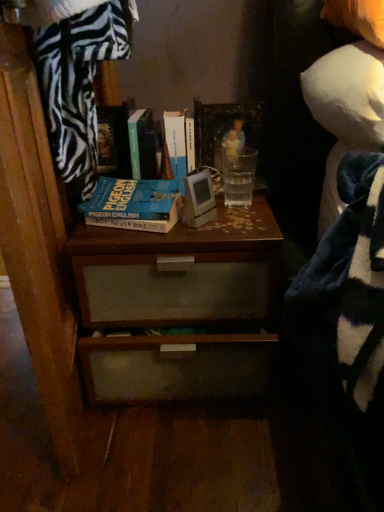
The height and width of the screenshot is (512, 384). I want to click on brown wood chest of drawers at center, so click(179, 307).

Measure the distance between green matte book at upper center, arranged as the 2th book when viewed from the left, and camera.

green matte book at upper center, arranged as the 2th book when viewed from the left, and camera are 3.32 feet apart from each other.

What is the approximate height of blue matte book at center, placed as the third book when sorted from right to left?

It is 3.36 inches.

Describe the element at coordinates (134, 204) in the screenshot. Image resolution: width=384 pixels, height=512 pixels. I see `blue matte book at center, placed as the third book when sorted from right to left` at that location.

What do you see at coordinates (78, 84) in the screenshot? Image resolution: width=384 pixels, height=512 pixels. I see `zebra-patterned fabric at upper left` at bounding box center [78, 84].

Where is `zebra-patterned fabric at upper left`? zebra-patterned fabric at upper left is located at coordinates (78, 84).

Measure the distance between point (180, 151) and camera.

Point (180, 151) is 3.50 feet away from camera.

Find the location of a particular element. Image resolution: width=384 pixels, height=512 pixels. brown wood chest of drawers at center is located at coordinates (179, 307).

What are the coordinates of `chest of drawers below the green matte book at upper center, which is counted as the second book, starting from the right (from a real-world perspective)` in the screenshot? It's located at (179, 307).

Based on the photo, is brown wood chest of drawers at center to the left or to the right of green matte book at upper center, arranged as the 2th book when viewed from the left, in the image?

brown wood chest of drawers at center is positioned on green matte book at upper center, arranged as the 2th book when viewed from the left,'s right side.

Who is taller, brown wood chest of drawers at center or green matte book at upper center, arranged as the 2th book when viewed from the left?

brown wood chest of drawers at center is taller.

Considering the sizes of objects brown wood chest of drawers at center and green matte book at upper center, arranged as the 2th book when viewed from the left, in the image provided, who is wider, brown wood chest of drawers at center or green matte book at upper center, arranged as the 2th book when viewed from the left,?

Wider between the two is brown wood chest of drawers at center.

In the scene shown: Can you tell me how much hardcover book at center, marked as the 3th book in a left-to-right arrangement, and brown wood chest of drawers at center differ in facing direction?

0.000389 degrees separate the facing orientations of hardcover book at center, marked as the 3th book in a left-to-right arrangement, and brown wood chest of drawers at center.

Which object is more forward, hardcover book at center, marked as the 3th book in a left-to-right arrangement, or brown wood chest of drawers at center?

brown wood chest of drawers at center.

Can you confirm if hardcover book at center, the 1th book positioned from the right, is smaller than brown wood chest of drawers at center?

Yes, hardcover book at center, the 1th book positioned from the right, is smaller than brown wood chest of drawers at center.

Which of these two, wooden picture frame at center or brown wood chest of drawers at center, stands taller?

brown wood chest of drawers at center is taller.

Does wooden picture frame at center appear on the right side of brown wood chest of drawers at center?

Yes, wooden picture frame at center is to the right of brown wood chest of drawers at center.

Identify the location of chest of drawers on the left of wooden picture frame at center. This screenshot has width=384, height=512. (179, 307).

From the image's perspective, which is above, wooden picture frame at center or brown wood chest of drawers at center?

wooden picture frame at center is shown above in the image.

Can you confirm if zebra-patterned fabric at upper left is bigger than green matte book at upper center, which is counted as the second book, starting from the right?

Indeed, zebra-patterned fabric at upper left has a larger size compared to green matte book at upper center, which is counted as the second book, starting from the right.

Which object is more forward, zebra-patterned fabric at upper left or green matte book at upper center, arranged as the 2th book when viewed from the left?

zebra-patterned fabric at upper left.

Would you say zebra-patterned fabric at upper left is outside green matte book at upper center, arranged as the 2th book when viewed from the left?

Absolutely, zebra-patterned fabric at upper left is external to green matte book at upper center, arranged as the 2th book when viewed from the left.

Is point (140, 210) behind point (264, 298)?

No, (140, 210) is closer to viewer.

Who is shorter, blue matte book at center, placed as the third book when sorted from right to left, or brown wood chest of drawers at center?

With less height is blue matte book at center, placed as the third book when sorted from right to left.

Which is more to the left, blue matte book at center, placed as the third book when sorted from right to left, or brown wood chest of drawers at center?

Positioned to the left is blue matte book at center, placed as the third book when sorted from right to left.

Are blue matte book at center, placed as the third book when sorted from right to left, and brown wood chest of drawers at center far apart?

They are positioned close to each other.

Is hardcover book at center, marked as the 3th book in a left-to-right arrangement, facing towards white fabric doll at upper right?

No, hardcover book at center, marked as the 3th book in a left-to-right arrangement, is not aimed at white fabric doll at upper right.

Which is in front, hardcover book at center, marked as the 3th book in a left-to-right arrangement, or white fabric doll at upper right?

white fabric doll at upper right is in front.

How many degrees apart are the facing directions of hardcover book at center, marked as the 3th book in a left-to-right arrangement, and white fabric doll at upper right?

They differ by 0.468 degrees in their facing directions.

From the image's perspective, is hardcover book at center, the 1th book positioned from the right, on top of white fabric doll at upper right?

No, from the image's perspective, hardcover book at center, the 1th book positioned from the right, is not on top of white fabric doll at upper right.

Is wooden picture frame at center wider or thinner than green matte book at upper center, arranged as the 2th book when viewed from the left?

wooden picture frame at center is thinner than green matte book at upper center, arranged as the 2th book when viewed from the left.

Based on the photo, is wooden picture frame at center with green matte book at upper center, arranged as the 2th book when viewed from the left?

There is a gap between wooden picture frame at center and green matte book at upper center, arranged as the 2th book when viewed from the left.

Can you tell me how much wooden picture frame at center and green matte book at upper center, arranged as the 2th book when viewed from the left, differ in facing direction?

They differ by 0.000689 degrees in their facing directions.

The image size is (384, 512). I want to click on the 2nd book directly above the wooden picture frame at center (from a real-world perspective), so click(142, 144).

Where is `book that is the 3rd one above the brown wood chest of drawers at center (from a real-world perspective)`? book that is the 3rd one above the brown wood chest of drawers at center (from a real-world perspective) is located at coordinates (x=142, y=144).

From the image's perspective, which book is the 3rd one above the brown wood chest of drawers at center? Please provide its 2D coordinates.

[(175, 145)]

Estimate the real-world distances between objects in this image. Which object is closer to white fabric doll at upper right, green matte book at upper center, arranged as the 2th book when viewed from the left, or hardcover book at center, the 1th book positioned from the right?

Based on the image, hardcover book at center, the 1th book positioned from the right, appears to be nearer to white fabric doll at upper right.

From the image, which object appears to be nearer to blue matte book at center, positioned as the 1th book in left-to-right order, zebra-patterned fabric at upper left or white fabric doll at upper right?

Based on the image, zebra-patterned fabric at upper left appears to be nearer to blue matte book at center, positioned as the 1th book in left-to-right order.

When comparing their distances from brown wood chest of drawers at center, does zebra-patterned fabric at upper left or green matte book at upper center, arranged as the 2th book when viewed from the left, seem further?

green matte book at upper center, arranged as the 2th book when viewed from the left, is positioned further to the anchor brown wood chest of drawers at center.

Consider the image. Estimate the real-world distances between objects in this image. Which object is further from brown wood chest of drawers at center, white fabric doll at upper right or blue matte book at center, placed as the third book when sorted from right to left?

Based on the image, white fabric doll at upper right appears to be further to brown wood chest of drawers at center.

Looking at the image, which one is located further to wooden picture frame at center, zebra-patterned fabric at upper left or blue matte book at center, positioned as the 1th book in left-to-right order?

zebra-patterned fabric at upper left.

Estimate the real-world distances between objects in this image. Which object is closer to blue matte book at center, placed as the third book when sorted from right to left, hardcover book at center, marked as the 3th book in a left-to-right arrangement, or white fabric doll at upper right?

hardcover book at center, marked as the 3th book in a left-to-right arrangement, is positioned closer to the anchor blue matte book at center, placed as the third book when sorted from right to left.

Which object lies nearer to the anchor point brown wood chest of drawers at center, zebra-patterned fabric at upper left or wooden picture frame at center?

Among the two, zebra-patterned fabric at upper left is located nearer to brown wood chest of drawers at center.

When comparing their distances from hardcover book at center, the 1th book positioned from the right, does white fabric doll at upper right or zebra-patterned fabric at upper left seem further?

The object further to hardcover book at center, the 1th book positioned from the right, is white fabric doll at upper right.

Image resolution: width=384 pixels, height=512 pixels. What are the coordinates of `chest of drawers between green matte book at upper center, which is counted as the second book, starting from the right, and white fabric doll at upper right, in the horizontal direction` in the screenshot? It's located at (179, 307).

Where is `book that lies between green matte book at upper center, which is counted as the second book, starting from the right, and brown wood chest of drawers at center from top to bottom`? This screenshot has height=512, width=384. book that lies between green matte book at upper center, which is counted as the second book, starting from the right, and brown wood chest of drawers at center from top to bottom is located at coordinates (134, 204).

At what (x,y) coordinates should I click in order to perform the action: click on the chest of drawers located between blue matte book at center, positioned as the 1th book in left-to-right order, and white fabric doll at upper right in the left-right direction. Please return your answer as a coordinate pair (x, y). This screenshot has width=384, height=512. Looking at the image, I should click on (179, 307).

At what (x,y) coordinates should I click in order to perform the action: click on book between wooden picture frame at center and brown wood chest of drawers at center in the up-down direction. Please return your answer as a coordinate pair (x, y). This screenshot has height=512, width=384. Looking at the image, I should click on (134, 204).